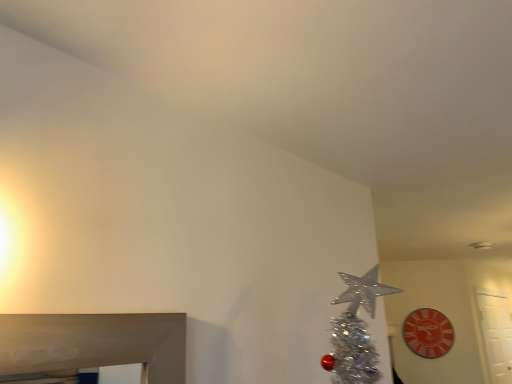
This screenshot has height=384, width=512. What do you see at coordinates (428, 333) in the screenshot? I see `orange metallic clock at right` at bounding box center [428, 333].

The image size is (512, 384). I want to click on orange metallic clock at right, so click(428, 333).

You are a GUI agent. You are given a task and a screenshot of the screen. Output one action in this format:
    pyautogui.click(x=<x>, y=<y>)
    Task: Click on the orange metallic clock at right
    This screenshot has width=512, height=384.
    Given the screenshot: What is the action you would take?
    pyautogui.click(x=428, y=333)